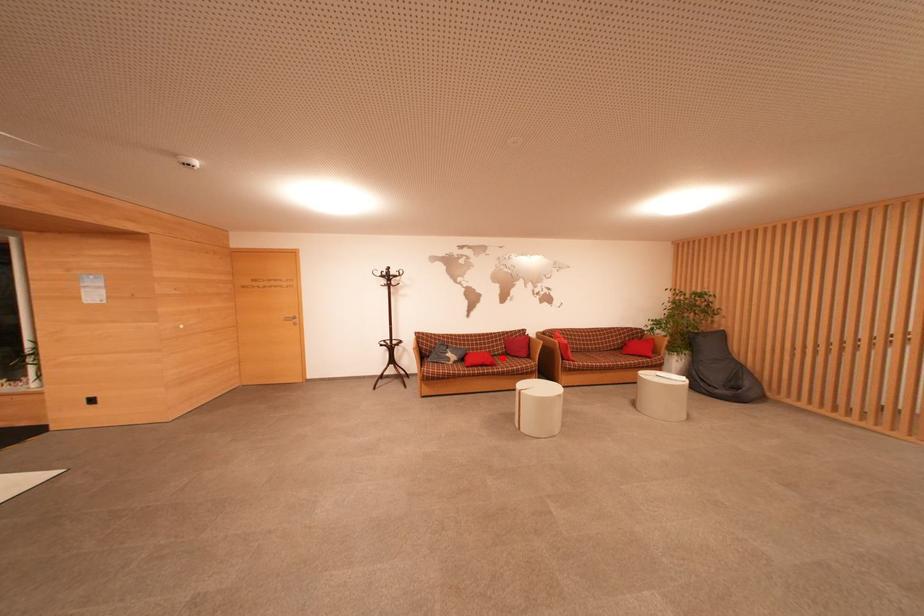
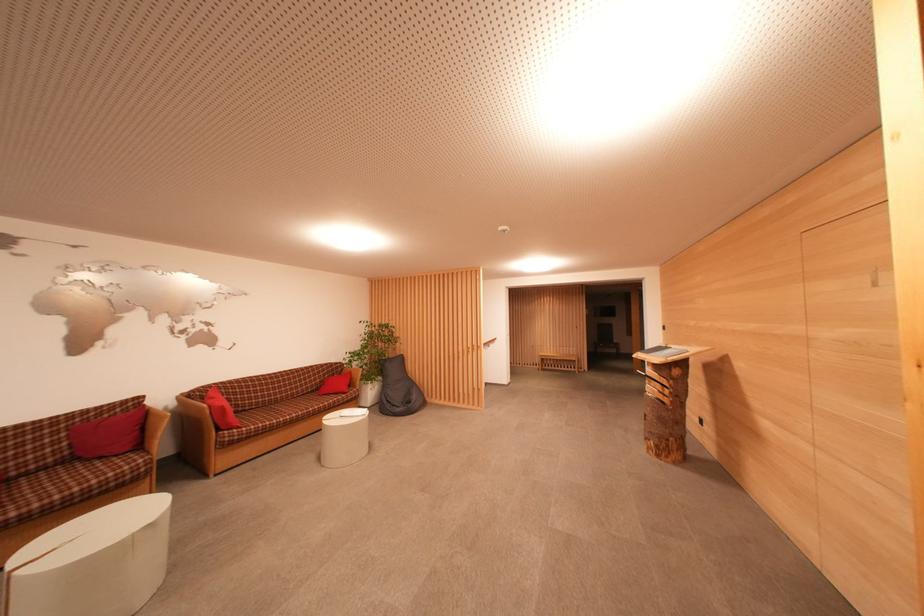
In the second image, find the point that corresponds to the highlighted location in the first image.

(45, 472)